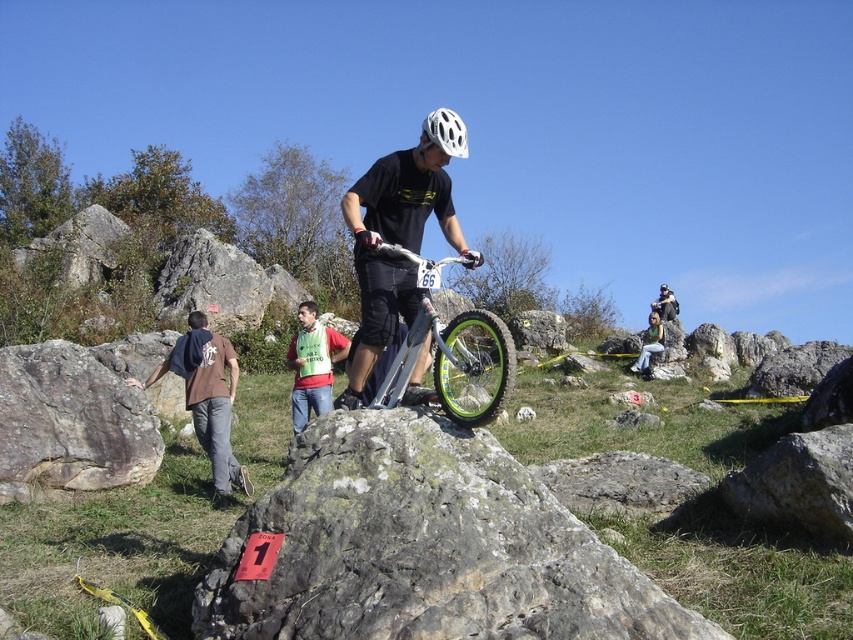
Question: Considering the real-world distances, which object is farthest from the matte black helmet at upper center?

Choices:
 (A) brown cotton shirt at left
 (B) green fabric shirt at center
 (C) silver metallic mountain bike at center

Answer: (C)

Question: Does green fabric shirt at center have a greater width compared to matte black helmet at upper center?

Choices:
 (A) no
 (B) yes

Answer: (A)

Question: Is green fabric shirt at center wider than matte black helmet at upper center?

Choices:
 (A) yes
 (B) no

Answer: (B)

Question: Can you confirm if white matte bicycle helmet at center is positioned to the left of matte black helmet at upper center?

Choices:
 (A) yes
 (B) no

Answer: (A)

Question: Which point appears farthest from the camera in this image?

Choices:
 (A) (440, 368)
 (B) (664, 307)

Answer: (B)

Question: Which of these objects is positioned farthest from the green fabric shirt at center?

Choices:
 (A) matte black bicycle at center
 (B) brown cotton shirt at left
 (C) gray rough rock at left
 (D) matte black helmet at upper center

Answer: (D)